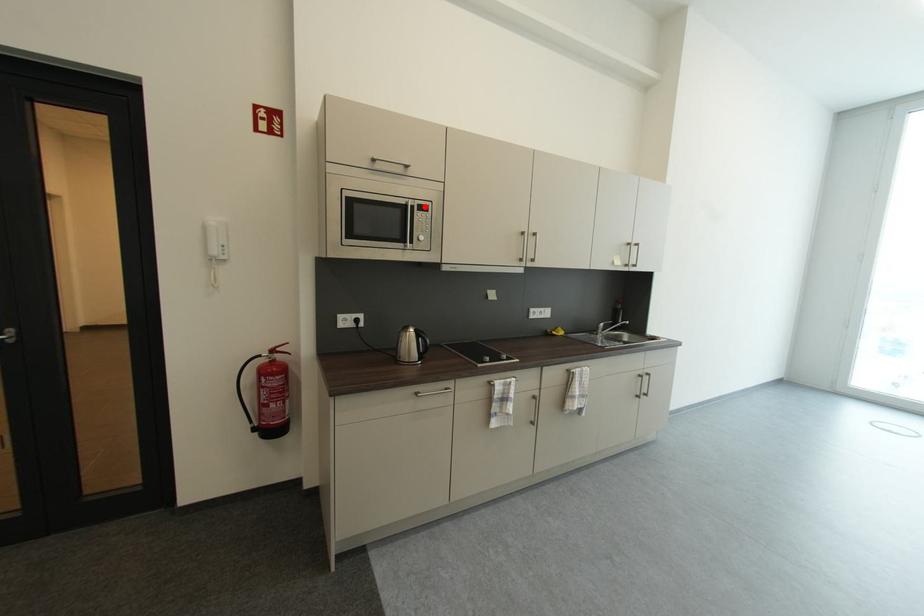
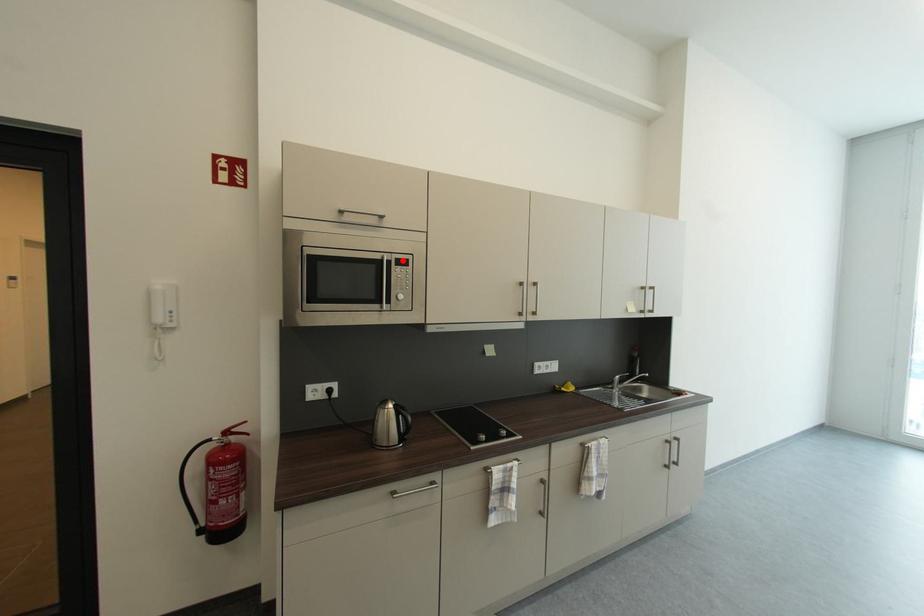
I am providing you with two images of the same scene from different viewpoints. A red point is marked on the first image and another point is marked on the second image. Does the point marked in image1 correspond to the same location as the one in image2?

Yes